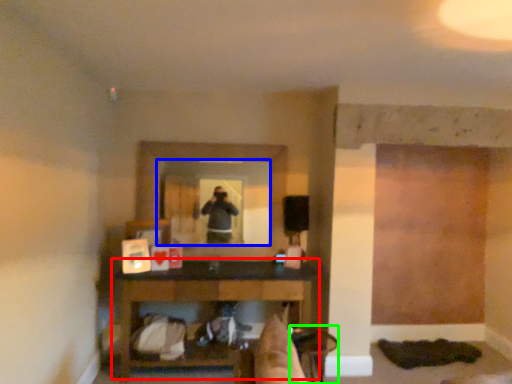
Question: Considering the real-world distances, which object is farthest from table (highlighted by a red box)? mirror (highlighted by a blue box) or chair (highlighted by a green box)?

Choices:
 (A) mirror
 (B) chair

Answer: (B)